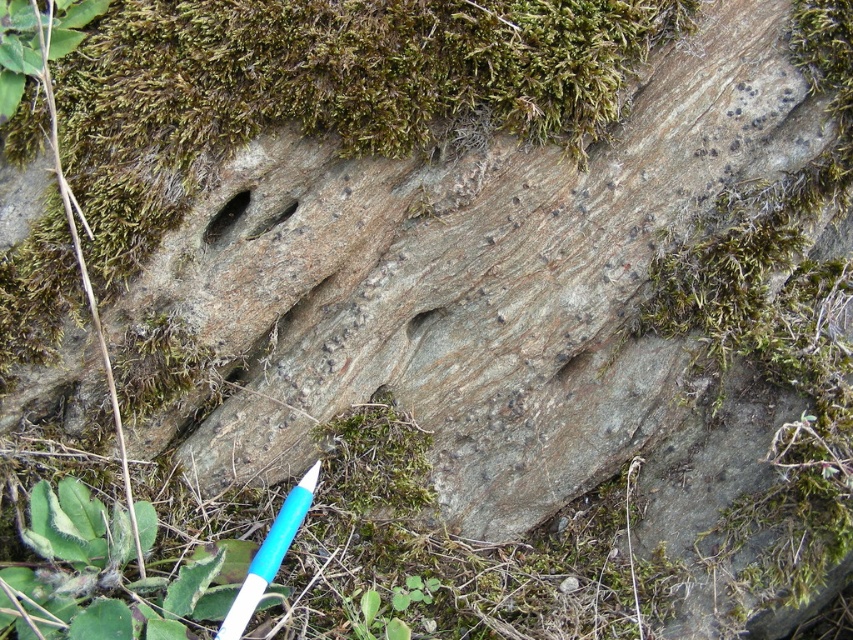
At what (x,y) coordinates should I click in order to perform the action: click on green mossy rock at upper center. Please return your answer as a coordinate pair (x, y). This screenshot has width=853, height=640. Looking at the image, I should click on (325, 90).

In the scene shown: Can you confirm if green mossy rock at upper center is positioned below smooth stone hole at center?

→ No.

Which is behind, point (495, 131) or point (287, 208)?

Point (287, 208)

The height and width of the screenshot is (640, 853). Find the location of `green mossy rock at upper center`. green mossy rock at upper center is located at coordinates (325, 90).

Can you confirm if green mossy rock at upper center is wider than brown rough hole at center?

Correct, the width of green mossy rock at upper center exceeds that of brown rough hole at center.

Which is below, green mossy rock at upper center or brown rough hole at center?

Positioned lower is brown rough hole at center.

The width and height of the screenshot is (853, 640). Describe the element at coordinates (325, 90) in the screenshot. I see `green mossy rock at upper center` at that location.

This screenshot has height=640, width=853. Find the location of `green mossy rock at upper center`. green mossy rock at upper center is located at coordinates (325, 90).

Which is above, white plastic pen at lower left or brown rough hole at center?

brown rough hole at center is higher up.

Who is more forward, (245, 588) or (225, 205)?

Point (245, 588) is in front.

At what (x,y) coordinates should I click in order to perform the action: click on white plastic pen at lower left. Please return your answer as a coordinate pair (x, y). Looking at the image, I should click on pyautogui.click(x=270, y=556).